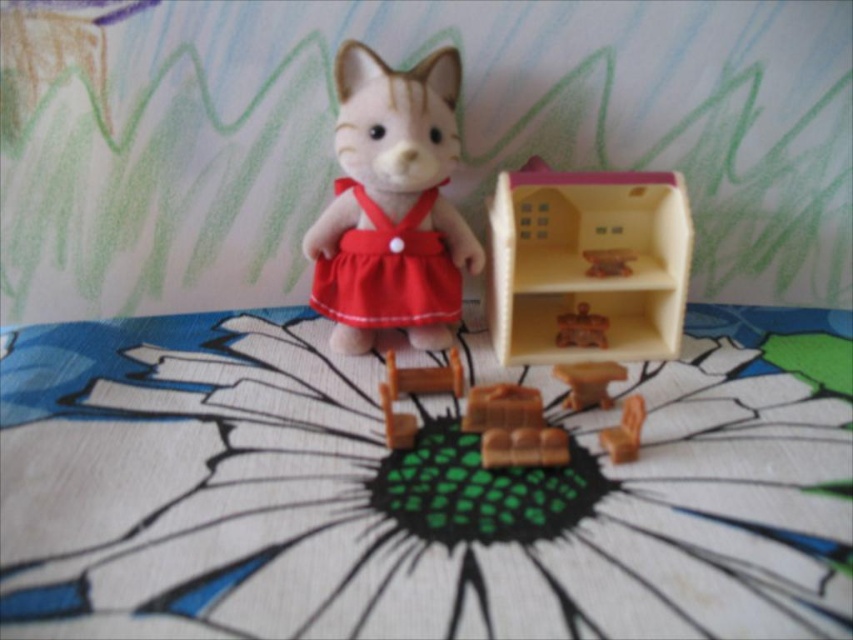
Which is above, wooden toy at center or wooden ladder at center?

wooden ladder at center is higher up.

Measure the distance between point (x=491, y=417) and camera.

Point (x=491, y=417) and camera are 1.05 meters apart from each other.

This screenshot has height=640, width=853. What are the coordinates of `wooden toy at center` in the screenshot? It's located at (512, 428).

Does velvet-like red dress at center appear on the right side of wooden chair at lower center?

No, velvet-like red dress at center is not to the right of wooden chair at lower center.

Where is `velvet-like red dress at center`? velvet-like red dress at center is located at coordinates (392, 204).

Find the location of a particular element. Image resolution: width=853 pixels, height=640 pixels. velvet-like red dress at center is located at coordinates [x=392, y=204].

Which is in front, point (611, 436) or point (589, 326)?

Point (611, 436) is in front.

Which is more to the left, wooden chair at lower center or wooden furniture at center?

Positioned to the left is wooden furniture at center.

At what (x,y) coordinates should I click in order to perform the action: click on wooden chair at lower center. Please return your answer as a coordinate pair (x, y). Looking at the image, I should click on (624, 432).